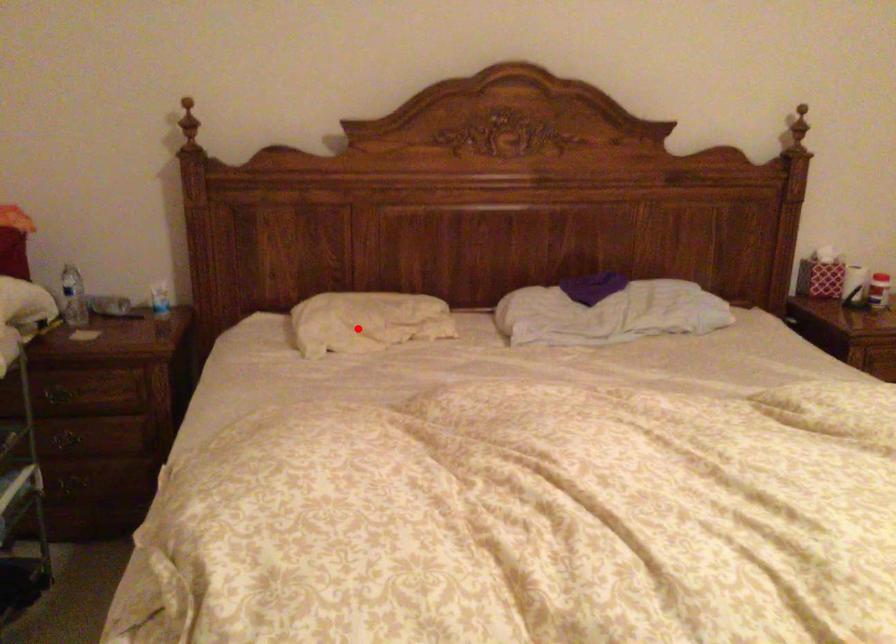
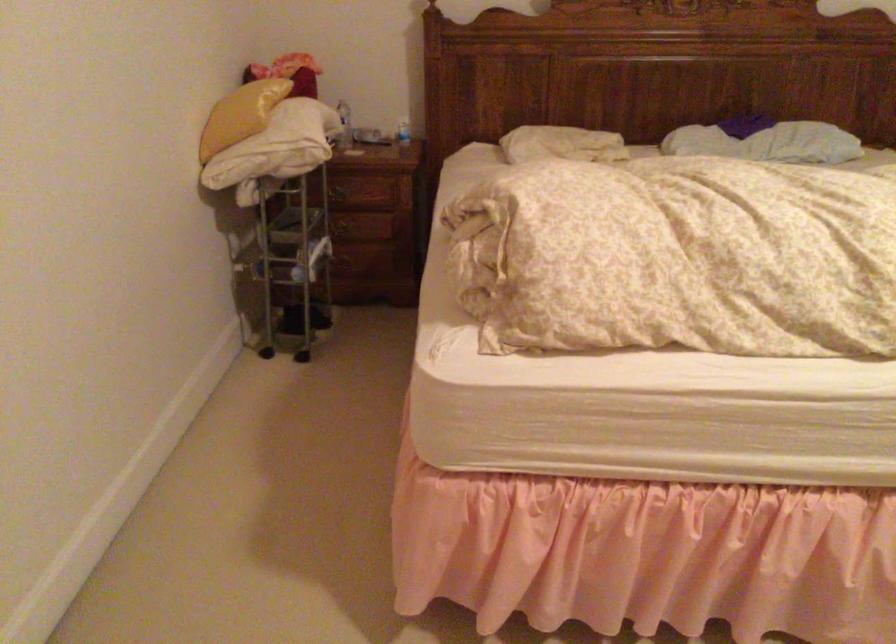
Question: I am providing you with two images of the same scene from different viewpoints. A red point is shown in image1. For the corresponding object point in image2, is it positioned nearer or farther from the camera?

Choices:
 (A) Nearer
 (B) Farther

Answer: (B)